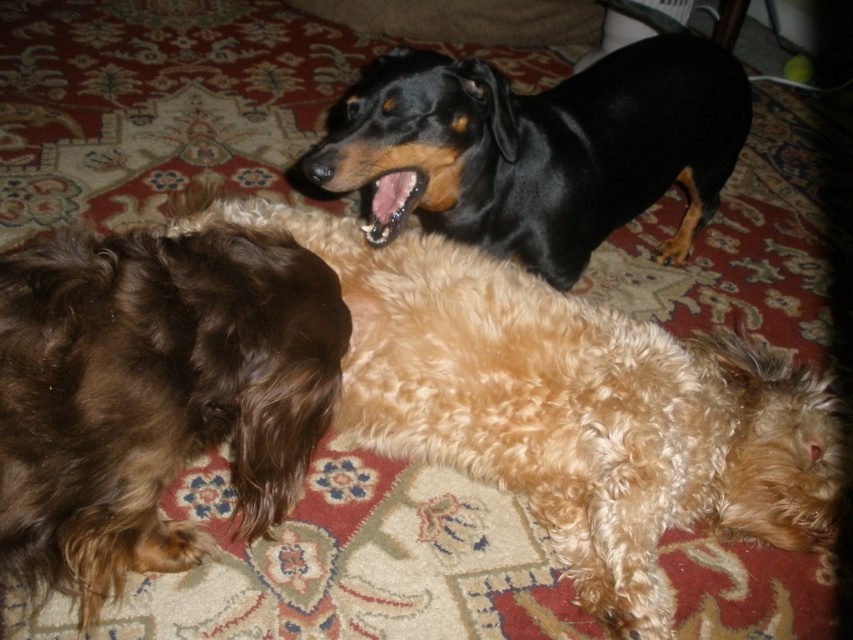
Who is taller, brown fuzzy dog at lower left or black shiny dog at upper center?

black shiny dog at upper center

Does point (178, 371) come in front of point (422, 152)?

Yes.

You are a GUI agent. You are given a task and a screenshot of the screen. Output one action in this format:
    pyautogui.click(x=<x>, y=<y>)
    Task: Click on the brown fuzzy dog at lower left
    This screenshot has height=640, width=853.
    Given the screenshot: What is the action you would take?
    pyautogui.click(x=154, y=394)

Looking at this image, who is shorter, brown curly fur dog at upper left or brown fuzzy dog at lower left?

brown fuzzy dog at lower left

Locate an element on the screen. brown curly fur dog at upper left is located at coordinates (569, 406).

Can you confirm if brown curly fur dog at upper left is thinner than black shiny dog at upper center?

No, brown curly fur dog at upper left is not thinner than black shiny dog at upper center.

Where is `brown curly fur dog at upper left`? brown curly fur dog at upper left is located at coordinates (569, 406).

Between point (398, 449) and point (737, 77), which one is positioned in front?

Point (398, 449) is in front.

At what (x,y) coordinates should I click in order to perform the action: click on brown curly fur dog at upper left. Please return your answer as a coordinate pair (x, y). Looking at the image, I should click on (569, 406).